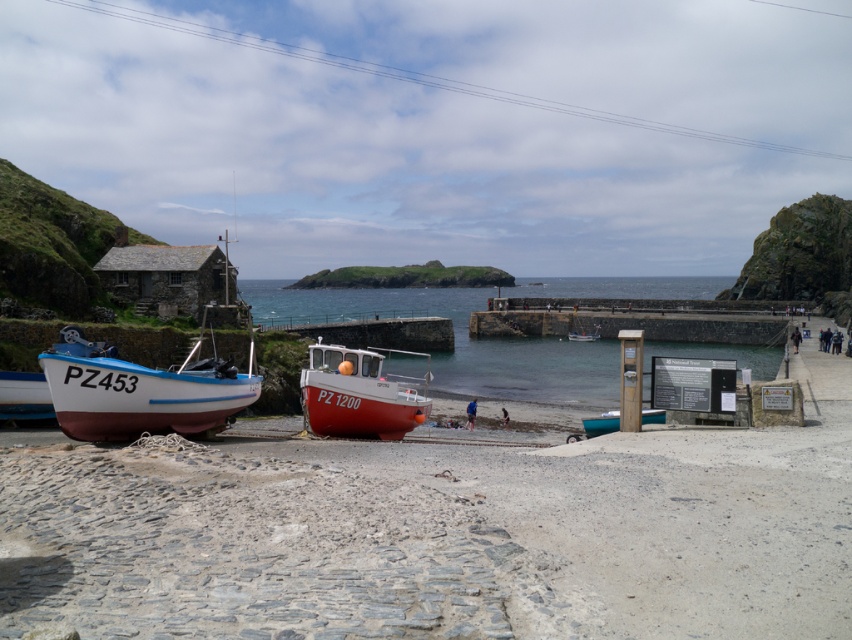
You are standing on the cobblestone path and want to board the white wooden boat at left and the teal matte canoe at center. Which boat will you reach first if you walk straight towards them?

The white wooden boat at left is closer to you, so you will reach it first before the teal matte canoe at center.

You are standing at the water edge and want to board the red matte boat at center. According to the coordinates provided, is the boat located to your left or right side?

The red matte boat at center is located at coordinates point (360, 394), which places it to your right side.